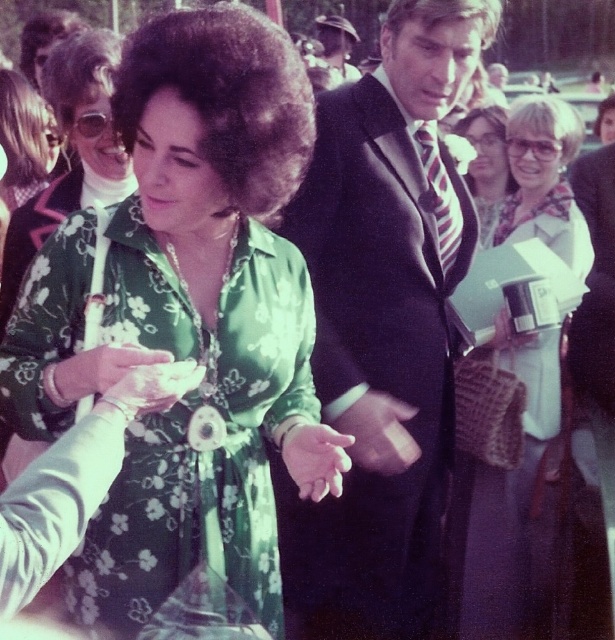
You are at a 1970s themed party and see the green floral fabric dress at center and the matte black suit at upper center. Which one is positioned lower in the image?

The green floral fabric dress at center is positioned below the matte black suit at upper center, so the dress is lower in the image.